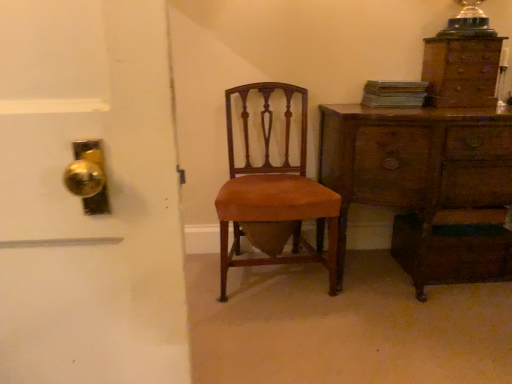
Question: From a real-world perspective, does translucent glass lampshade at upper right stand above wooden chest of drawers at right, placed as the second chest of drawers when sorted from top to bottom?

Choices:
 (A) no
 (B) yes

Answer: (B)

Question: Is there a large distance between translucent glass lampshade at upper right and wooden chest of drawers at right, the first chest of drawers positioned from the bottom?

Choices:
 (A) yes
 (B) no

Answer: (B)

Question: Would you say wooden chest of drawers at right, placed as the second chest of drawers when sorted from top to bottom, is part of translucent glass lampshade at upper right's contents?

Choices:
 (A) yes
 (B) no

Answer: (B)

Question: From a real-world perspective, does translucent glass lampshade at upper right sit lower than wooden chest of drawers at right, the first chest of drawers positioned from the bottom?

Choices:
 (A) no
 (B) yes

Answer: (A)

Question: Is translucent glass lampshade at upper right shorter than wooden chest of drawers at right, the first chest of drawers positioned from the bottom?

Choices:
 (A) no
 (B) yes

Answer: (B)

Question: Does translucent glass lampshade at upper right have a smaller size compared to wooden chest of drawers at right, the first chest of drawers positioned from the bottom?

Choices:
 (A) no
 (B) yes

Answer: (B)

Question: Does wooden chest of drawers at right, placed as the second chest of drawers when sorted from top to bottom, have a greater height compared to translucent glass lampshade at upper right?

Choices:
 (A) yes
 (B) no

Answer: (A)

Question: Would you say wooden chest of drawers at right, placed as the second chest of drawers when sorted from top to bottom, is outside translucent glass lampshade at upper right?

Choices:
 (A) no
 (B) yes

Answer: (B)

Question: Does wooden chest of drawers at right, the first chest of drawers positioned from the bottom, appear on the right side of translucent glass lampshade at upper right?

Choices:
 (A) yes
 (B) no

Answer: (B)

Question: From the image's perspective, is wooden chest of drawers at right, placed as the second chest of drawers when sorted from top to bottom, on top of translucent glass lampshade at upper right?

Choices:
 (A) yes
 (B) no

Answer: (B)

Question: Is wooden chest of drawers at right, the first chest of drawers positioned from the bottom, shorter than translucent glass lampshade at upper right?

Choices:
 (A) yes
 (B) no

Answer: (B)

Question: Does wooden chest of drawers at right, placed as the second chest of drawers when sorted from top to bottom, lie behind translucent glass lampshade at upper right?

Choices:
 (A) no
 (B) yes

Answer: (A)

Question: Would you consider wooden chest of drawers at right, the first chest of drawers positioned from the bottom, to be distant from brown wood chair at center?

Choices:
 (A) yes
 (B) no

Answer: (B)